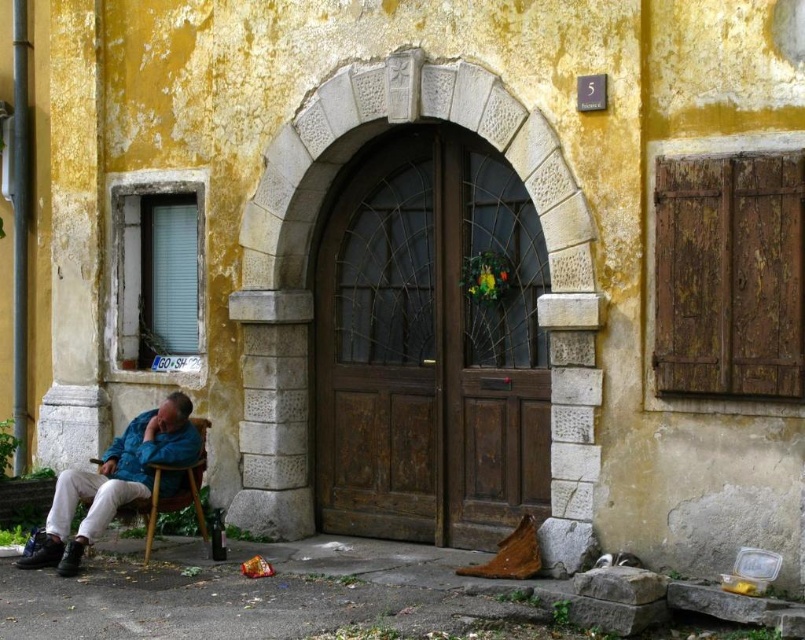
You are standing in front of the aged building with the weathered yellow facade. You need to locate the brown wooden door at center. Based on its 2D coordinates, where exactly is it positioned?

The brown wooden door at center is positioned at the 2D coordinates point (428, 348).